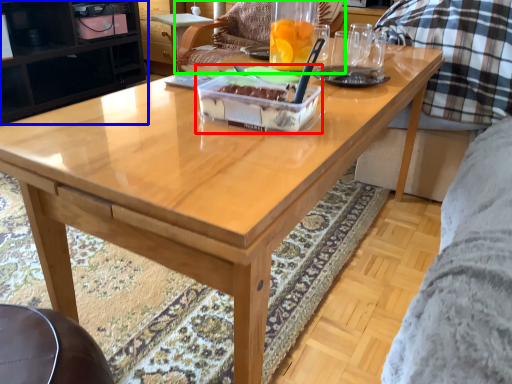
Question: Which is nearer to the cake (highlighted by a red box)? cabinetry (highlighted by a blue box) or chair (highlighted by a green box).

Choices:
 (A) cabinetry
 (B) chair

Answer: (B)